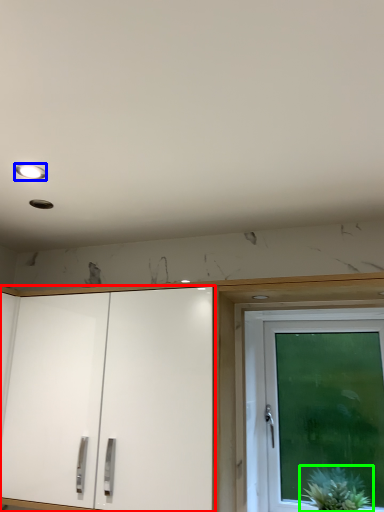
Question: Which object is positioned farthest from cabinetry (highlighted by a red box)? Select from lighting (highlighted by a blue box) and houseplant (highlighted by a green box).

Choices:
 (A) lighting
 (B) houseplant

Answer: (A)